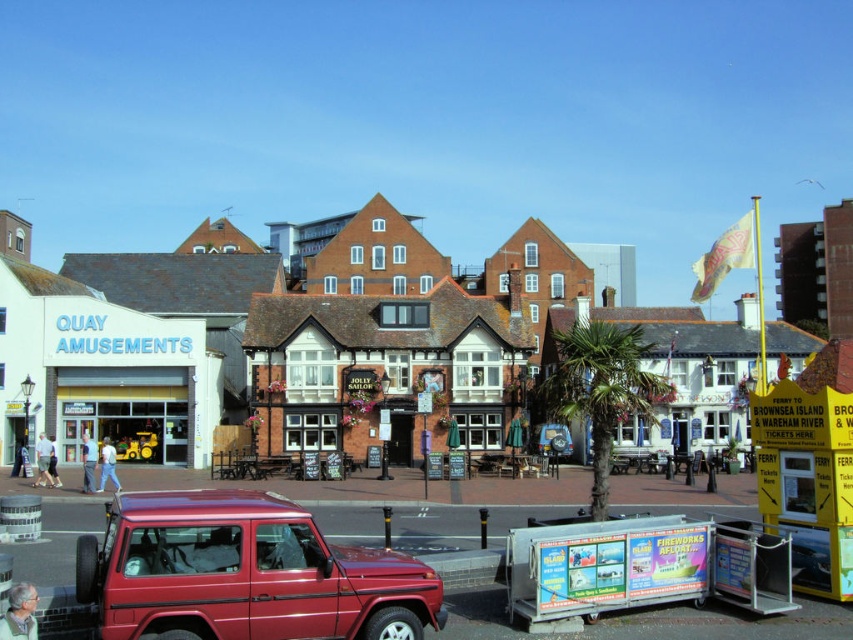
You are a delivery driver who needs to park your truck, which is 3 meters wide, between the white brick building at center and the shiny red suv at lower left. Based on the scene, can your truck fit in the space between them?

The white brick building at center is wider than the shiny red suv at lower left. However, the description only mentions their widths relative to each other, not the exact space between them. Without knowing the actual distance between the two objects, it is impossible to determine if your 3 meter wide truck can fit.

You are a tourist standing on the street and want to take a photo of the white brick building at center and the shiny red suv at lower left. Which object should you frame first in your camera viewfinder to ensure both are in the shot?

The white brick building at center is positioned on the left side of the shiny red suv at lower left, so you should frame the white brick building at center first to ensure both are in the shot.

You are standing at the entrance of the pub named The Sailor and want to go to the white brick building at center. Which direction should you walk to reach it?

The white brick building at center is located at point (318, 358), so you should walk towards the center of the street to reach it.